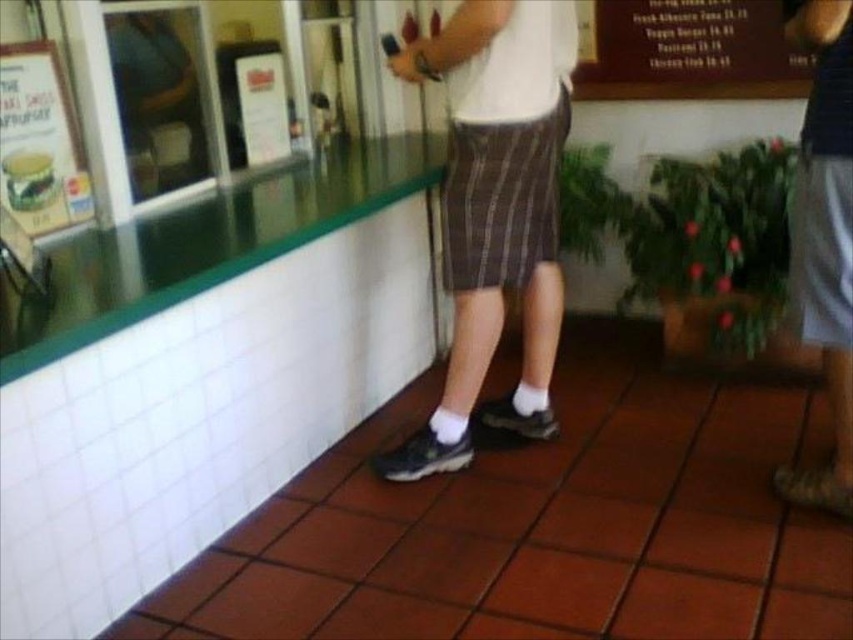
Is gray cotton shorts at right to the left of wooden sign at upper right from the viewer's perspective?

In fact, gray cotton shorts at right is to the right of wooden sign at upper right.

Is point (798, 476) less distant than point (782, 83)?

Yes, it is.

The image size is (853, 640). Identify the location of gray cotton shorts at right. (824, 237).

Find the location of a particular element. white cotton socks at lower center is located at coordinates pyautogui.click(x=492, y=218).

Does gray cotton shorts at right appear on the left side of matte paper menu at upper left?

No, gray cotton shorts at right is not to the left of matte paper menu at upper left.

Locate an element on the screen. This screenshot has height=640, width=853. gray cotton shorts at right is located at coordinates point(824,237).

Which is in front, point (837, 33) or point (67, 198)?

Positioned in front is point (837, 33).

The image size is (853, 640). What are the coordinates of `gray cotton shorts at right` in the screenshot? It's located at (824, 237).